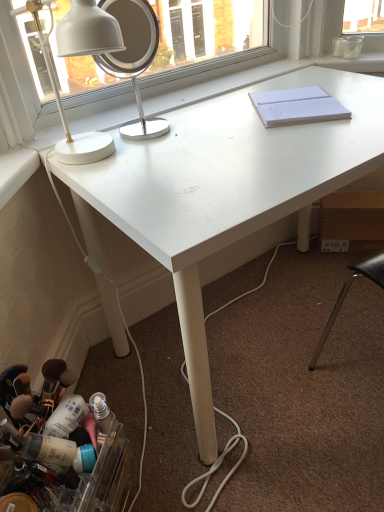
Where is `free spot to the right of white glossy desk lamp at upper left`? free spot to the right of white glossy desk lamp at upper left is located at coordinates (178, 151).